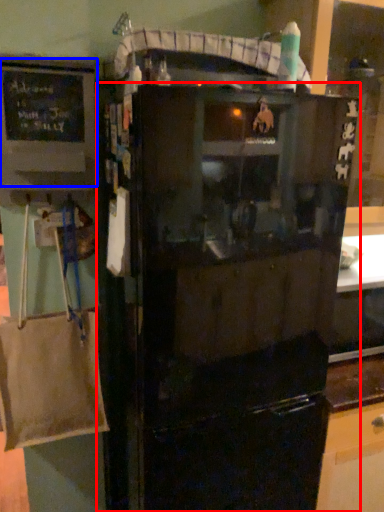
Question: Which point is further to the camera, refrigerator (highlighted by a red box) or bulletin board (highlighted by a blue box)?

Choices:
 (A) refrigerator
 (B) bulletin board

Answer: (B)